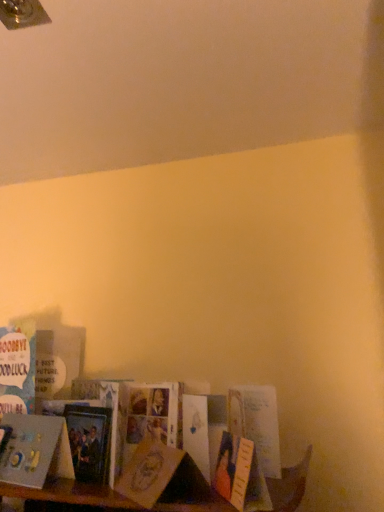
Question: Is matte paper card at lower left, which ranks as the second paperback book in back-to-front order, further to the viewer compared to blue paper card at lower left, which is the first book from back to front?

Choices:
 (A) no
 (B) yes

Answer: (A)

Question: Considering the relative sizes of matte paper card at lower left, marked as the 2th paperback book in a left-to-right arrangement, and blue paper card at lower left, which is the first book from back to front, in the image provided, is matte paper card at lower left, marked as the 2th paperback book in a left-to-right arrangement, bigger than blue paper card at lower left, which is the first book from back to front,?

Choices:
 (A) no
 (B) yes

Answer: (A)

Question: Is matte paper card at lower left, which is the 1th paperback book from right to left, not inside blue paper card at lower left, which is the first book from back to front?

Choices:
 (A) no
 (B) yes

Answer: (B)

Question: Is blue paper card at lower left, which is the first book from back to front, located within matte paper card at lower left, which is the 1th paperback book from right to left?

Choices:
 (A) no
 (B) yes

Answer: (A)

Question: Is blue paper card at lower left, which is the 2th book from front to back, taller or shorter than matte black book at lower left, the 1th paperback book when ordered from back to front?

Choices:
 (A) short
 (B) tall

Answer: (B)

Question: Would you say blue paper card at lower left, which is the first book from back to front, is inside or outside matte black book at lower left, arranged as the first paperback book when viewed from the left?

Choices:
 (A) inside
 (B) outside

Answer: (B)

Question: Considering the positions of point (3, 333) and point (86, 436), is point (3, 333) closer or farther from the camera than point (86, 436)?

Choices:
 (A) farther
 (B) closer

Answer: (A)

Question: From the image's perspective, is blue paper card at lower left, which is the 2th book from front to back, above or below matte black book at lower left, the 2th paperback book from the right?

Choices:
 (A) below
 (B) above

Answer: (B)

Question: From a real-world perspective, is matte paper card at lower left, which is the first paperback book from front to back, physically located above or below matte black book at lower left, arranged as the first paperback book when viewed from the left?

Choices:
 (A) below
 (B) above

Answer: (A)

Question: From the image's perspective, relative to matte black book at lower left, arranged as the first paperback book when viewed from the left, is matte paper card at lower left, which is the first paperback book from front to back, above or below?

Choices:
 (A) below
 (B) above

Answer: (A)

Question: Considering the relative positions of matte paper card at lower left, marked as the 2th paperback book in a left-to-right arrangement, and matte black book at lower left, which is the 2th paperback book from front to back, in the image provided, is matte paper card at lower left, marked as the 2th paperback book in a left-to-right arrangement, to the left or to the right of matte black book at lower left, which is the 2th paperback book from front to back,?

Choices:
 (A) right
 (B) left

Answer: (A)

Question: Is matte paper card at lower left, which is the 1th paperback book from right to left, wider or thinner than matte black book at lower left, arranged as the first paperback book when viewed from the left?

Choices:
 (A) thin
 (B) wide

Answer: (B)

Question: Considering the positions of point (21, 331) and point (135, 501), is point (21, 331) closer or farther from the camera than point (135, 501)?

Choices:
 (A) farther
 (B) closer

Answer: (A)

Question: In the image, is blue paper card at lower left, which is the 2th book from front to back, positioned in front of or behind matte paper card at lower left, which is the 1th paperback book from right to left?

Choices:
 (A) front
 (B) behind

Answer: (B)